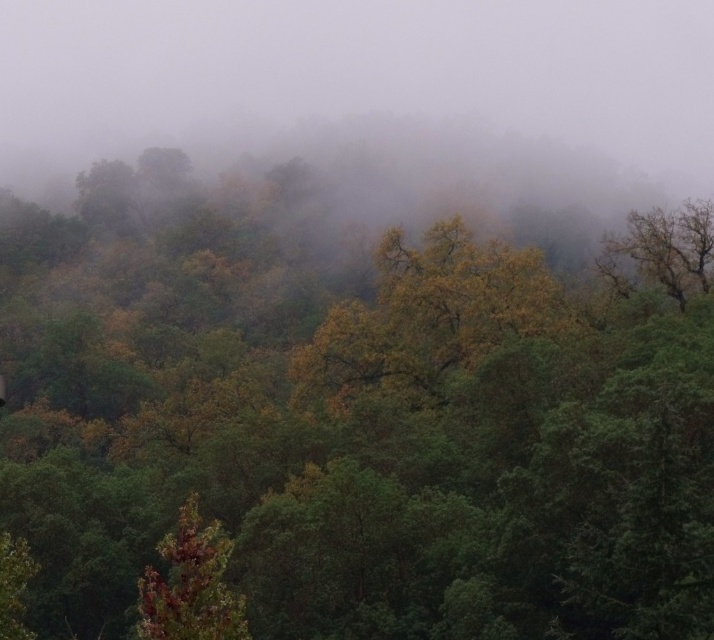
Looking at this image, you are a hiker lost in the misty forest. You see a brown matte tree at lower left and a green leafy tree at upper right. Which tree would appear larger to you from your current position?

The brown matte tree at lower left is bigger than the green leafy tree at upper right, so it would appear larger to you from your current position.

You are a hiker trying to navigate through the dense forest. You notice the foggy atmosphere at center and the brown matte tree at lower left. Which of these two is positioned more to the left side of your view?

The foggy atmosphere at center is to the left of brown matte tree at lower left, so the foggy atmosphere at center is positioned more to the left side of your view.

You are an explorer in the forest and need to locate the foggy atmosphere at center. According to the coordinates provided, where exactly should you look?

The foggy atmosphere at center is located at point coordinates of (368, 84).